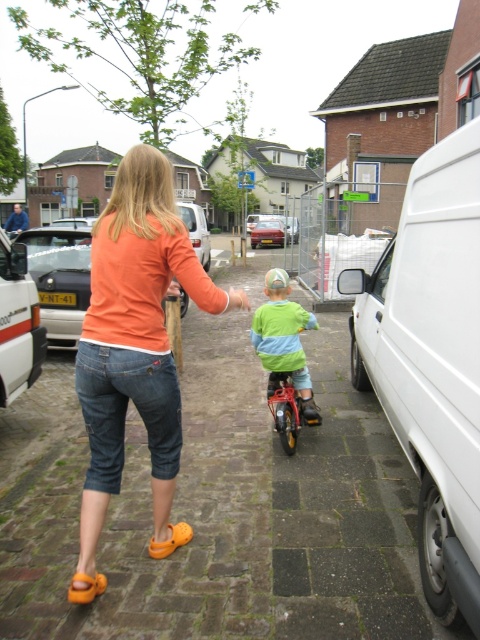
What do you see at coordinates (60, 278) in the screenshot? I see `matte white van at center` at bounding box center [60, 278].

Which is in front, point (79, 316) or point (264, 342)?

Point (264, 342) is more forward.

What are the coordinates of `matte white van at center` in the screenshot? It's located at (60, 278).

The width and height of the screenshot is (480, 640). What do you see at coordinates (60, 278) in the screenshot?
I see `matte white van at center` at bounding box center [60, 278].

Can you confirm if matte white van at center is bigger than metallic red bicycle at center?

Yes.

Does point (48, 280) come farther from viewer compared to point (295, 397)?

That is True.

At what (x,y) coordinates should I click in order to perform the action: click on matte white van at center. Please return your answer as a coordinate pair (x, y). The image size is (480, 640). Looking at the image, I should click on (60, 278).

Is light green jersey at center thinner than metallic red bicycle at center?

No, light green jersey at center is not thinner than metallic red bicycle at center.

Who is taller, light green jersey at center or metallic red bicycle at center?

light green jersey at center is taller.

Describe the element at coordinates (284, 340) in the screenshot. The image size is (480, 640). I see `light green jersey at center` at that location.

You are a GUI agent. You are given a task and a screenshot of the screen. Output one action in this format:
    pyautogui.click(x=<x>, y=<y>)
    Task: Click on the light green jersey at center
    
    Given the screenshot: What is the action you would take?
    [x=284, y=340]